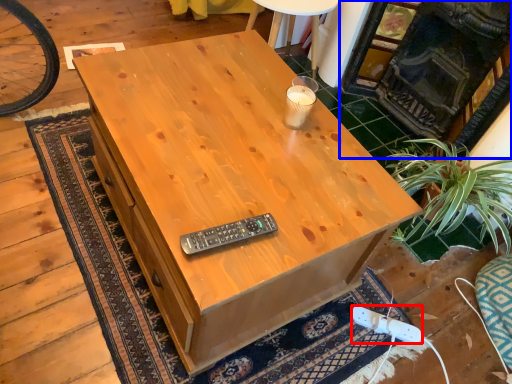
Question: Which point is further to the camera, plug (highlighted by a red box) or fireplace (highlighted by a blue box)?

Choices:
 (A) plug
 (B) fireplace

Answer: (A)